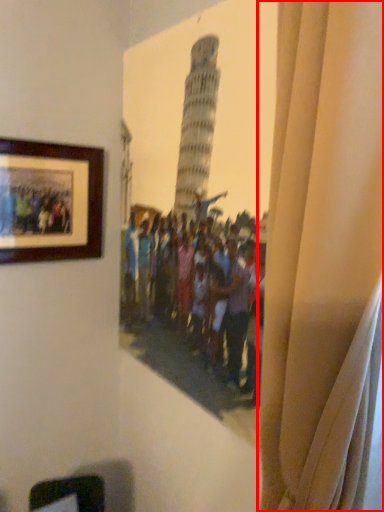
Question: Where is curtain (annotated by the red box) located in relation to picture frame in the image?

Choices:
 (A) left
 (B) right

Answer: (B)